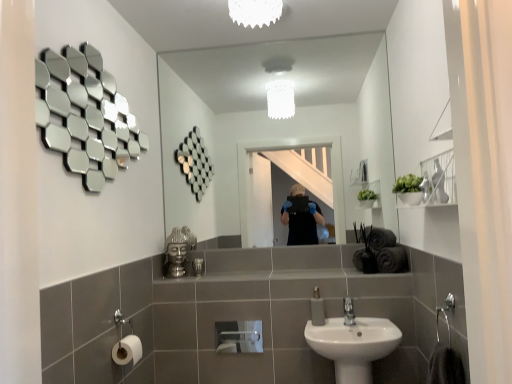
Where is `spots to the right of white matte soap dispenser at lower center`? The height and width of the screenshot is (384, 512). spots to the right of white matte soap dispenser at lower center is located at coordinates (355, 326).